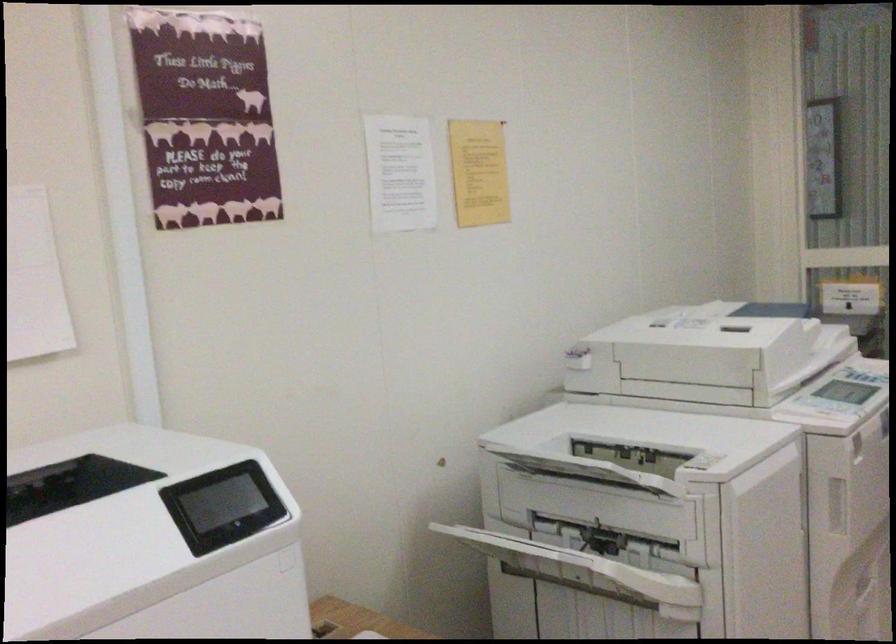
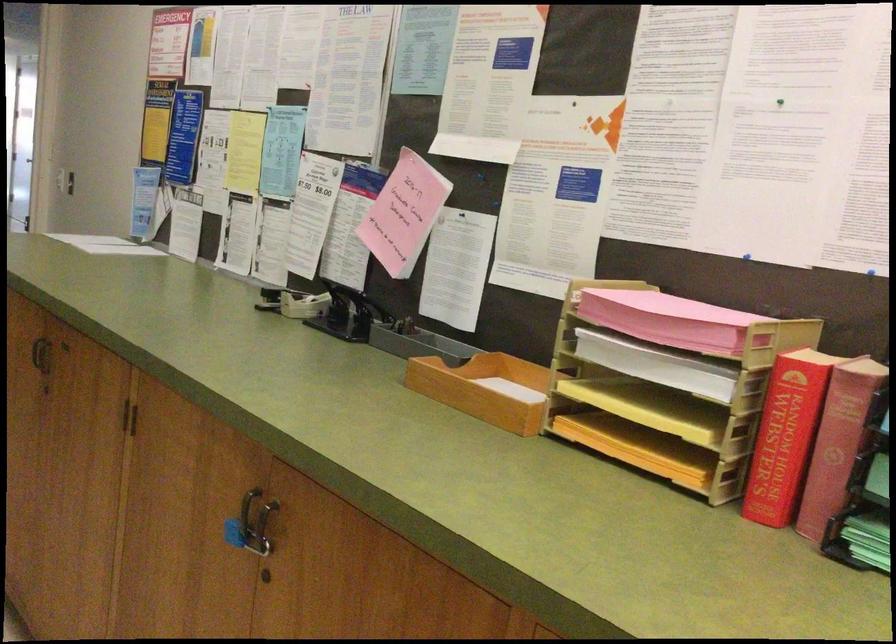
Question: The camera is either moving clockwise (left) or counter-clockwise (right) around the object. The first image is from the beginning of the video and the second image is from the end. Is the camera moving left or right when shooting the video?

Choices:
 (A) Left
 (B) Right

Answer: (A)